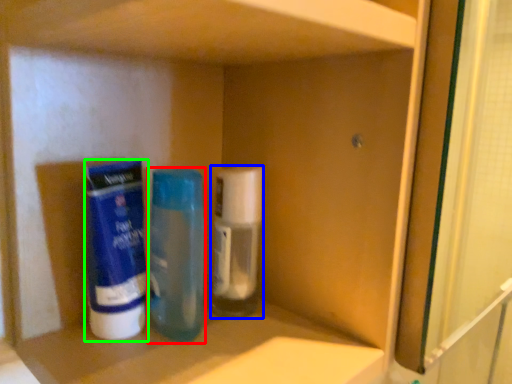
Question: Which object is the closest to the bottle (highlighted by a red box)? Choose among these: bottle (highlighted by a blue box) or cleaning product (highlighted by a green box).

Choices:
 (A) bottle
 (B) cleaning product

Answer: (A)